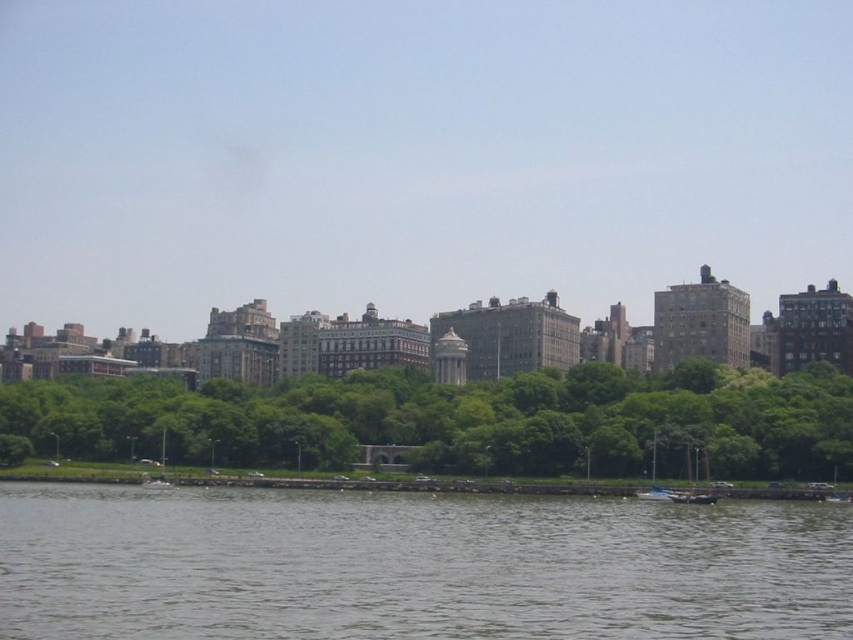
Looking at this image, you are standing at the origin point of the image. Which direction should you walk to reach the green leafy trees at center?

The green leafy trees at center are located at point (460, 420), so you should walk towards the right and forward to reach them.

You are a photographer planning to capture the waterfront cityscape. You want to position your camera so that both the wooden boat at lower right and the white plastic boat at lower left are in the frame. Which boat should you place closer to the center of the image to ensure both are visible without cropping?

The wooden boat at lower right is thinner than the white plastic boat at lower left, so you should place the wooden boat at lower right closer to the center to accommodate the wider white plastic boat at lower left and ensure both fit in the frame.

You are standing at the center of the waterfront scene. There is a point marked at coordinates (x=693, y=483). What object is located at that point?

The point at coordinates (x=693, y=483) corresponds to the wooden boat at lower right.